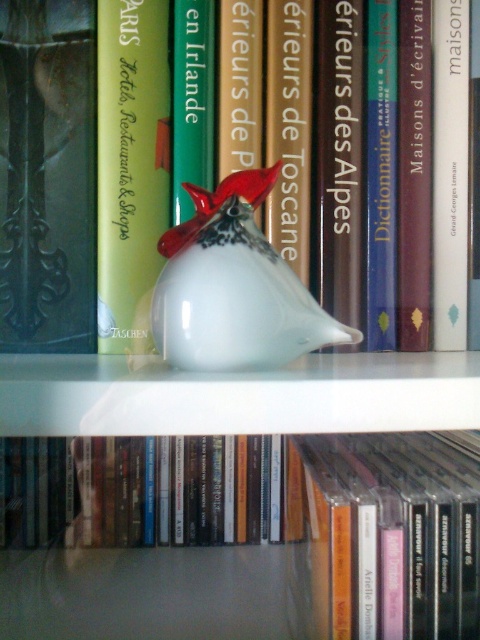
Question: Does hardcover book at center come behind white glass vase at center?

Choices:
 (A) no
 (B) yes

Answer: (B)

Question: Among these points, which one is farthest from the camera?

Choices:
 (A) (279, 628)
 (B) (204, 204)

Answer: (A)

Question: Which object appears closest to the camera in this image?

Choices:
 (A) white glass vase at center
 (B) hardcover book at center

Answer: (A)

Question: Can you confirm if hardcover book at center is positioned to the left of white glass vase at center?

Choices:
 (A) yes
 (B) no

Answer: (A)

Question: Does hardcover book at center have a smaller size compared to white glass vase at center?

Choices:
 (A) no
 (B) yes

Answer: (A)